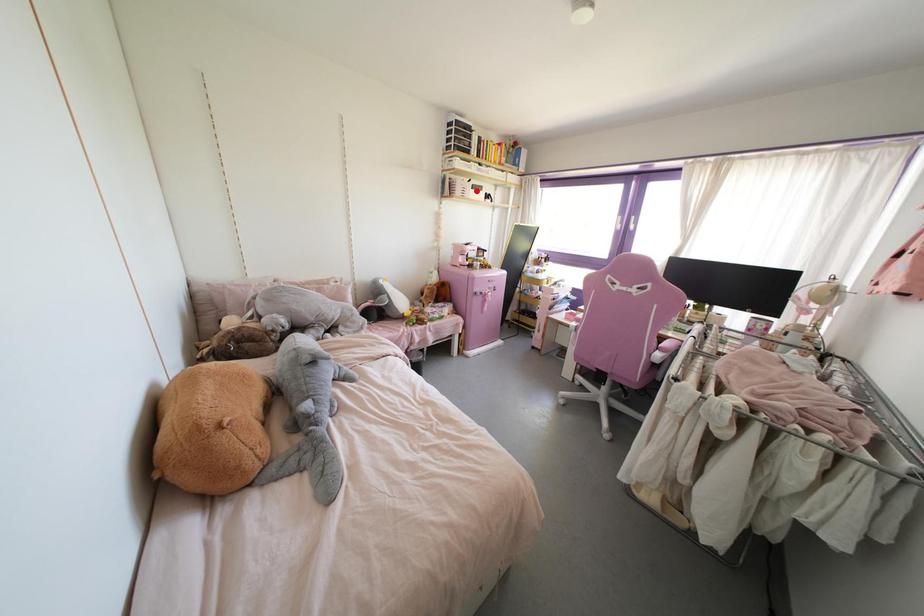
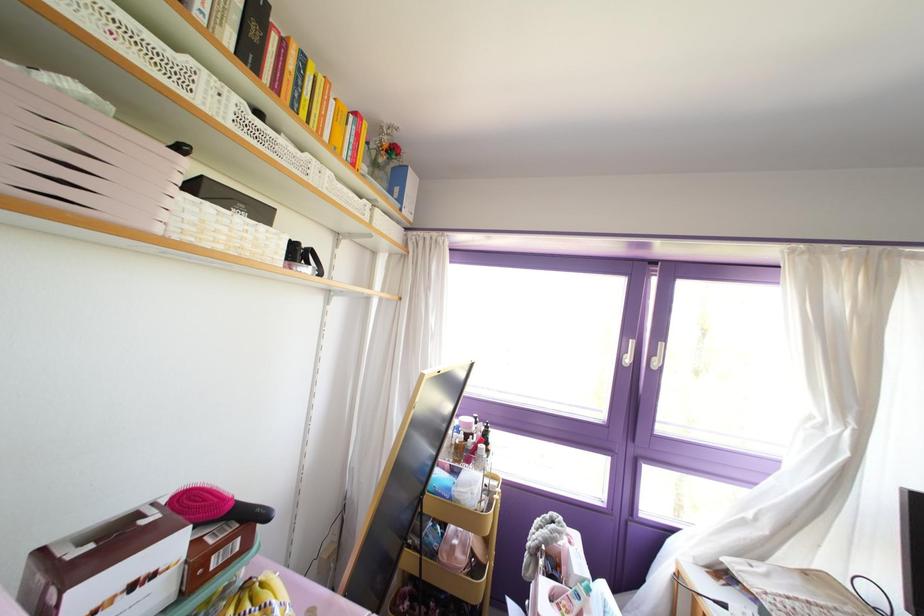
Question: I am providing you with two images of the same scene from different viewpoints. A red point is shown in image1. For the corresponding object point in image2, is it positioned nearer or farther from the camera?

Choices:
 (A) Nearer
 (B) Farther

Answer: (B)